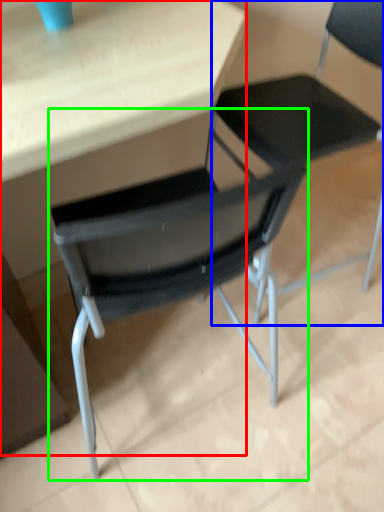
Question: Considering the real-world distances, which object is closest to table (highlighted by a red box)? chair (highlighted by a blue box) or chair (highlighted by a green box).

Choices:
 (A) chair
 (B) chair

Answer: (B)